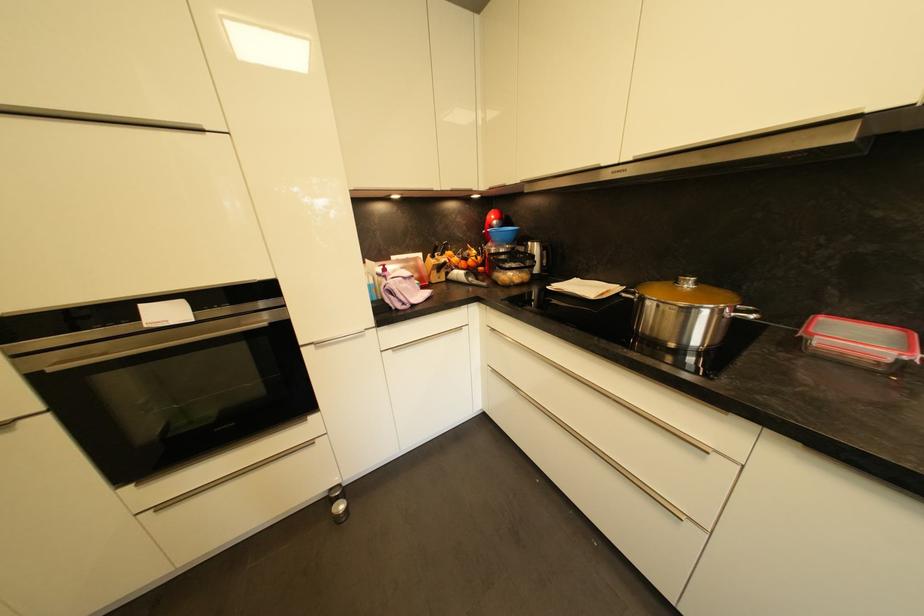
Where would you latch the red lid clip? Please return your answer as a coordinate pair (x, y).

(824, 326)